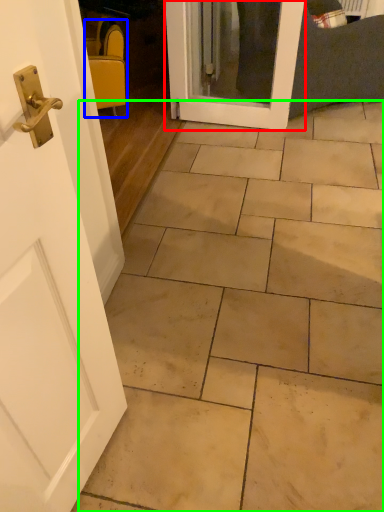
Question: Which object is the farthest from door (highlighted by a red box)? Choose among these: chair (highlighted by a blue box) or ceramic tile (highlighted by a green box).

Choices:
 (A) chair
 (B) ceramic tile

Answer: (B)